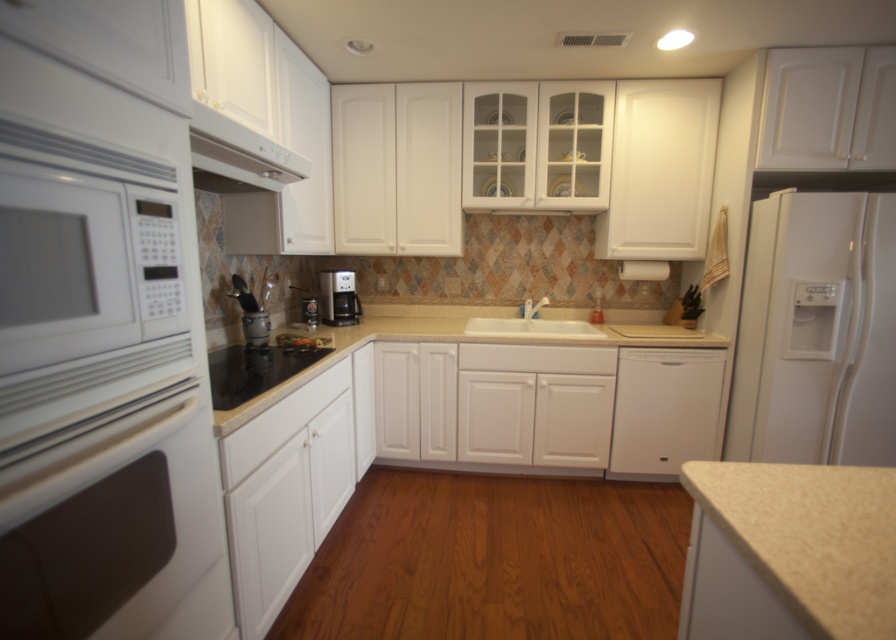
Is the position of white matte refrigerator at right less distant than that of beige granite countertop at center?

No, it is behind beige granite countertop at center.

You are a GUI agent. You are given a task and a screenshot of the screen. Output one action in this format:
    pyautogui.click(x=<x>, y=<y>)
    Task: Click on the white matte refrigerator at right
    The width and height of the screenshot is (896, 640).
    Given the screenshot: What is the action you would take?
    pyautogui.click(x=816, y=332)

Measure the distance from white matte refrigerator at right to white glossy sink at center.

white matte refrigerator at right and white glossy sink at center are 37.33 inches apart from each other.

Is white matte refrigerator at right positioned in front of white glossy sink at center?

Yes, it is in front of white glossy sink at center.

Is point (782, 292) more distant than point (569, 328)?

No, (782, 292) is in front of (569, 328).

At what (x,y) coordinates should I click in order to perform the action: click on white matte refrigerator at right. Please return your answer as a coordinate pair (x, y). Looking at the image, I should click on (816, 332).

Who is higher up, beige granite countertop at center or black glass stove at center?

beige granite countertop at center is higher up.

Which is in front, point (350, 349) or point (261, 372)?

Point (261, 372) is more forward.

What do you see at coordinates (444, 340) in the screenshot?
I see `beige granite countertop at center` at bounding box center [444, 340].

At what (x,y) coordinates should I click in order to perform the action: click on beige granite countertop at center. Please return your answer as a coordinate pair (x, y). This screenshot has width=896, height=640. Looking at the image, I should click on (444, 340).